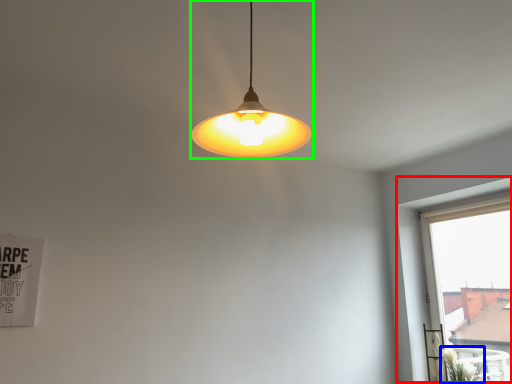
Question: Which object is the farthest from window (highlighted by a red box)? Choose among these: plant (highlighted by a blue box) or lamp (highlighted by a green box).

Choices:
 (A) plant
 (B) lamp

Answer: (B)